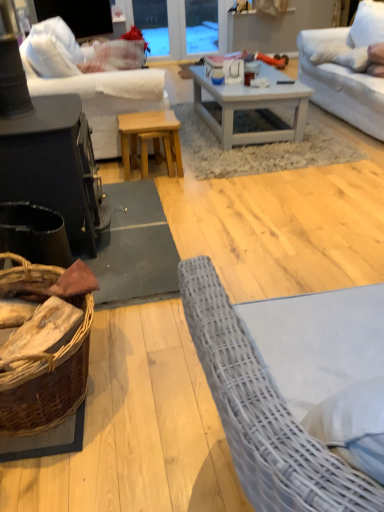
Question: Could you tell me if white fabric couch at upper right, which is the second studio couch in left-to-right order, is turned towards black matte wood table at left, which appears as the second table when viewed from the back?

Choices:
 (A) no
 (B) yes

Answer: (B)

Question: Can black matte wood table at left, which appears as the second table when viewed from the back, be found inside white fabric couch at upper right, the first studio couch positioned from the right?

Choices:
 (A) no
 (B) yes

Answer: (A)

Question: Is white fabric couch at upper right, the first studio couch positioned from the right, looking in the opposite direction of black matte wood table at left, which appears as the second table when viewed from the back?

Choices:
 (A) yes
 (B) no

Answer: (B)

Question: Considering the relative sizes of white fabric couch at upper right, which is the second studio couch in left-to-right order, and black matte wood table at left, which appears as the second table when viewed from the back, in the image provided, is white fabric couch at upper right, which is the second studio couch in left-to-right order, thinner than black matte wood table at left, which appears as the second table when viewed from the back,?

Choices:
 (A) yes
 (B) no

Answer: (B)

Question: Considering the relative sizes of white fabric couch at upper right, the first studio couch positioned from the right, and black matte wood table at left, which appears as the second table when viewed from the back, in the image provided, is white fabric couch at upper right, the first studio couch positioned from the right, taller than black matte wood table at left, which appears as the second table when viewed from the back,?

Choices:
 (A) no
 (B) yes

Answer: (A)

Question: Would you say white fabric couch at upper right, the first studio couch positioned from the right, is inside or outside transparent glass door at upper center?

Choices:
 (A) outside
 (B) inside

Answer: (A)

Question: Is point (372, 9) positioned closer to the camera than point (142, 20)?

Choices:
 (A) farther
 (B) closer

Answer: (B)

Question: In terms of width, does white fabric couch at upper right, the first studio couch positioned from the right, look wider or thinner when compared to transparent glass door at upper center?

Choices:
 (A) thin
 (B) wide

Answer: (B)

Question: Would you say white fabric couch at upper right, the first studio couch positioned from the right, is to the left or to the right of transparent glass door at upper center in the picture?

Choices:
 (A) right
 (B) left

Answer: (A)

Question: Considering the positions of transparent glass door at upper center and white fabric couch at upper left, the 2th studio couch when ordered from right to left, in the image, is transparent glass door at upper center wider or thinner than white fabric couch at upper left, the 2th studio couch when ordered from right to left,?

Choices:
 (A) thin
 (B) wide

Answer: (A)

Question: Is point (165, 10) positioned closer to the camera than point (109, 151)?

Choices:
 (A) farther
 (B) closer

Answer: (A)

Question: Would you say transparent glass door at upper center is to the left or to the right of white fabric couch at upper left, the 2th studio couch when ordered from right to left, in the picture?

Choices:
 (A) right
 (B) left

Answer: (A)

Question: Do you think transparent glass door at upper center is within white fabric couch at upper left, the 2th studio couch when ordered from right to left, or outside of it?

Choices:
 (A) outside
 (B) inside

Answer: (A)

Question: Considering the positions of point (177, 11) and point (165, 123), is point (177, 11) closer or farther from the camera than point (165, 123)?

Choices:
 (A) farther
 (B) closer

Answer: (A)

Question: From the image's perspective, is transparent glass door at upper center positioned above or below natural wood stool at center, the second table from the front?

Choices:
 (A) above
 (B) below

Answer: (A)